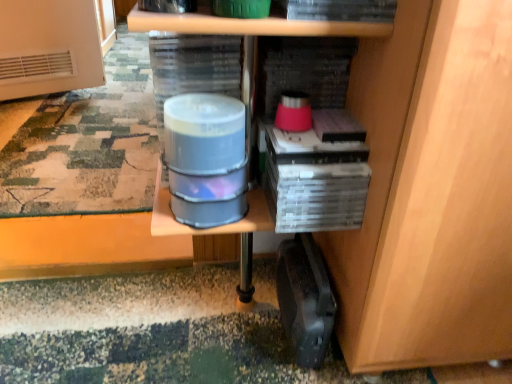
Question: Is black plastic briefcase at lower right next to translucent plastic water at center?

Choices:
 (A) no
 (B) yes

Answer: (A)

Question: Is black plastic briefcase at lower right far from translucent plastic water at center?

Choices:
 (A) no
 (B) yes

Answer: (A)

Question: From a real-world perspective, is black plastic briefcase at lower right beneath translucent plastic water at center?

Choices:
 (A) no
 (B) yes

Answer: (B)

Question: Can you confirm if black plastic briefcase at lower right is wider than translucent plastic water at center?

Choices:
 (A) no
 (B) yes

Answer: (A)

Question: Is black plastic briefcase at lower right bigger than translucent plastic water at center?

Choices:
 (A) no
 (B) yes

Answer: (B)

Question: From the image's perspective, is black plastic briefcase at lower right located above translucent plastic water at center?

Choices:
 (A) no
 (B) yes

Answer: (A)

Question: Is translucent plastic water at center turned away from black plastic briefcase at lower right?

Choices:
 (A) yes
 (B) no

Answer: (B)

Question: From the image's perspective, is translucent plastic water at center above black plastic briefcase at lower right?

Choices:
 (A) no
 (B) yes

Answer: (B)

Question: Is translucent plastic water at center further to the viewer compared to black plastic briefcase at lower right?

Choices:
 (A) no
 (B) yes

Answer: (A)

Question: Is translucent plastic water at center outside black plastic briefcase at lower right?

Choices:
 (A) no
 (B) yes

Answer: (B)

Question: Considering the relative sizes of translucent plastic water at center and black plastic briefcase at lower right in the image provided, is translucent plastic water at center thinner than black plastic briefcase at lower right?

Choices:
 (A) yes
 (B) no

Answer: (B)

Question: Is translucent plastic water at center to the right of black plastic briefcase at lower right from the viewer's perspective?

Choices:
 (A) yes
 (B) no

Answer: (B)

Question: Does translucent plastic water at center have a smaller size compared to camouflage fabric mat at lower left?

Choices:
 (A) yes
 (B) no

Answer: (A)